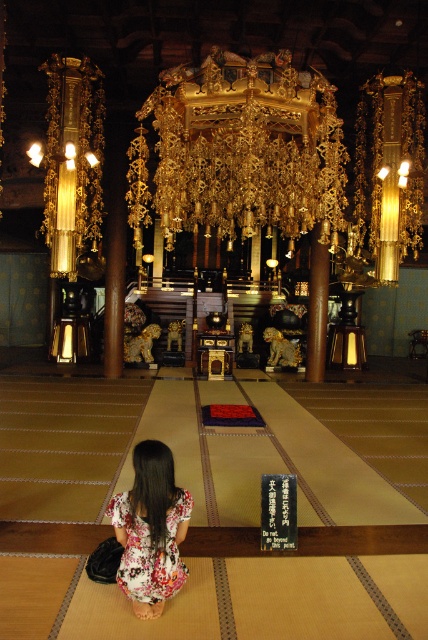
Question: Is gold metallic chandelier at center to the left of floral fabric dress at lower center from the viewer's perspective?

Choices:
 (A) yes
 (B) no

Answer: (B)

Question: Can you confirm if gold metallic chandelier at center is positioned to the right of floral fabric dress at lower center?

Choices:
 (A) yes
 (B) no

Answer: (A)

Question: Can you confirm if gold metallic chandelier at center is bigger than floral fabric dress at lower center?

Choices:
 (A) no
 (B) yes

Answer: (B)